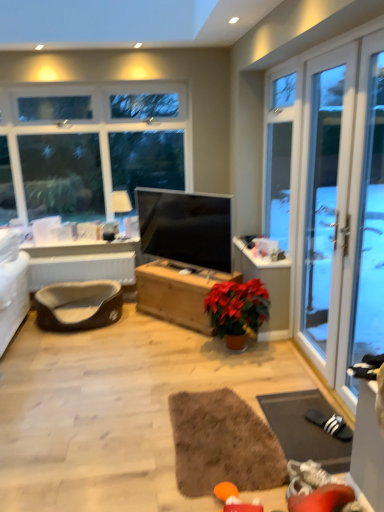
Question: Does matte black tv at center have a lesser width compared to brown plush pet bed at lower left?

Choices:
 (A) no
 (B) yes

Answer: (B)

Question: From a real-world perspective, is matte black tv at center under brown plush pet bed at lower left?

Choices:
 (A) no
 (B) yes

Answer: (A)

Question: Is matte black tv at center closer to the viewer compared to brown plush pet bed at lower left?

Choices:
 (A) yes
 (B) no

Answer: (A)

Question: Is matte black tv at center taller than brown plush pet bed at lower left?

Choices:
 (A) yes
 (B) no

Answer: (A)

Question: Is matte black tv at center facing towards brown plush pet bed at lower left?

Choices:
 (A) yes
 (B) no

Answer: (B)

Question: Is matte black tv at center far from brown plush pet bed at lower left?

Choices:
 (A) yes
 (B) no

Answer: (B)

Question: Is wooden chest at center not close to brown fabric pet bed at lower left?

Choices:
 (A) yes
 (B) no

Answer: (B)

Question: Does wooden chest at center have a lesser width compared to brown fabric pet bed at lower left?

Choices:
 (A) yes
 (B) no

Answer: (B)

Question: From the image's perspective, does wooden chest at center appear higher than brown fabric pet bed at lower left?

Choices:
 (A) no
 (B) yes

Answer: (A)

Question: Can you confirm if wooden chest at center is taller than brown fabric pet bed at lower left?

Choices:
 (A) no
 (B) yes

Answer: (A)

Question: From the image's perspective, is wooden chest at center beneath brown fabric pet bed at lower left?

Choices:
 (A) no
 (B) yes

Answer: (B)

Question: Is brown fabric pet bed at lower left at the back of wooden chest at center?

Choices:
 (A) no
 (B) yes

Answer: (A)

Question: Could you tell me if transparent glass screen door at right is facing brown fabric pet bed at lower left?

Choices:
 (A) yes
 (B) no

Answer: (B)